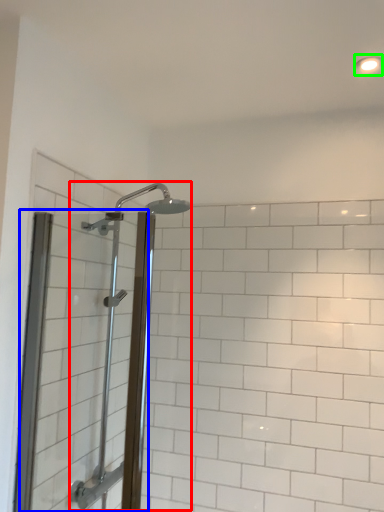
Question: Estimate the real-world distances between objects in this image. Which object is closer to shower (highlighted by a red box), screen door (highlighted by a blue box) or light fixture (highlighted by a green box)?

Choices:
 (A) screen door
 (B) light fixture

Answer: (A)